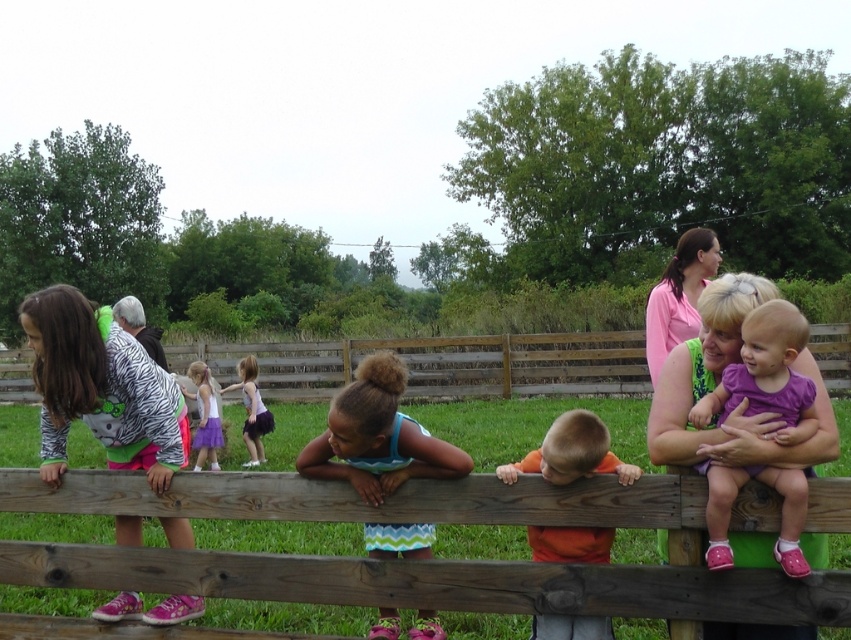
Is point (184, 392) positioned behind point (123, 324)?

That is True.

Which is in front, point (209, 384) or point (140, 332)?

Point (140, 332) is more forward.

Does point (216, 419) come farther from viewer compared to point (130, 301)?

Yes.

Locate an element on the screen. This screenshot has height=640, width=851. light purple dress at center is located at coordinates click(204, 416).

Looking at this image, between brown wooden fence at center and pink matte shirt at upper center, which one has more height?

With more height is pink matte shirt at upper center.

Can you confirm if brown wooden fence at center is positioned to the left of pink matte shirt at upper center?

Indeed, brown wooden fence at center is positioned on the left side of pink matte shirt at upper center.

Locate an element on the screen. The width and height of the screenshot is (851, 640). brown wooden fence at center is located at coordinates (409, 563).

Is zebra print hoodie at left below purple fabric baby at center?

No, zebra print hoodie at left is not below purple fabric baby at center.

This screenshot has width=851, height=640. Describe the element at coordinates (100, 388) in the screenshot. I see `zebra print hoodie at left` at that location.

The height and width of the screenshot is (640, 851). Identify the location of zebra print hoodie at left. (100, 388).